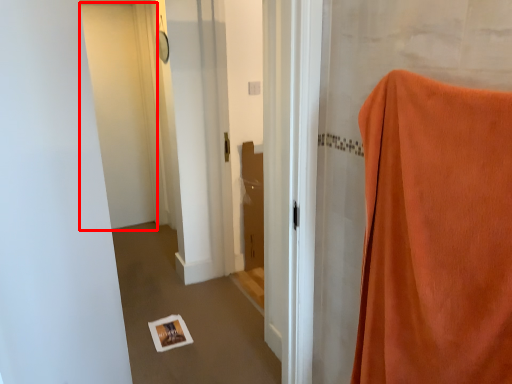
Question: From the image's perspective, where is door (annotated by the red box) located relative to curtain?

Choices:
 (A) above
 (B) below

Answer: (A)